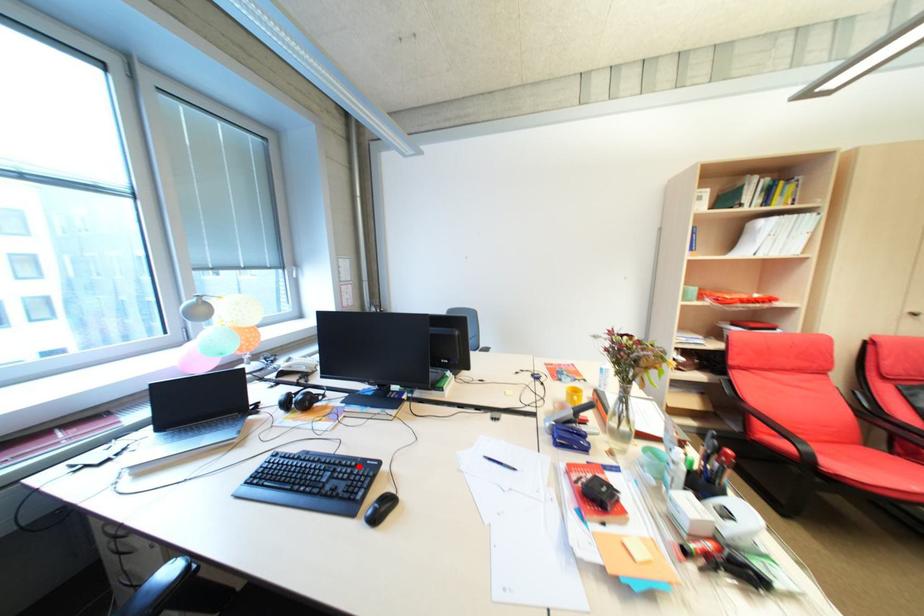
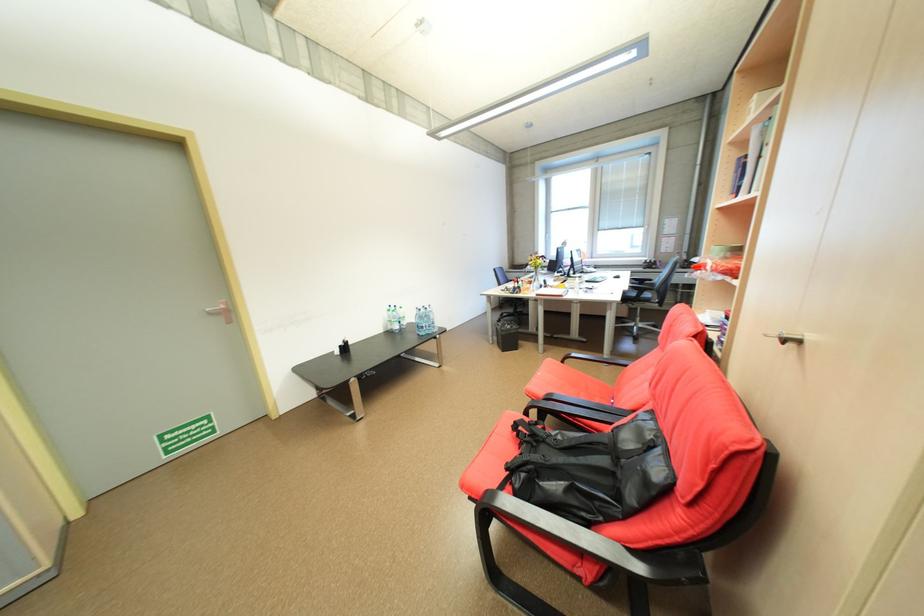
Question: I am providing you with two images of the same scene from different viewpoints. A red point is marked on the first image. At the location where the point appears in image 1, is it still visible in image 2?

Choices:
 (A) Yes
 (B) No

Answer: (B)